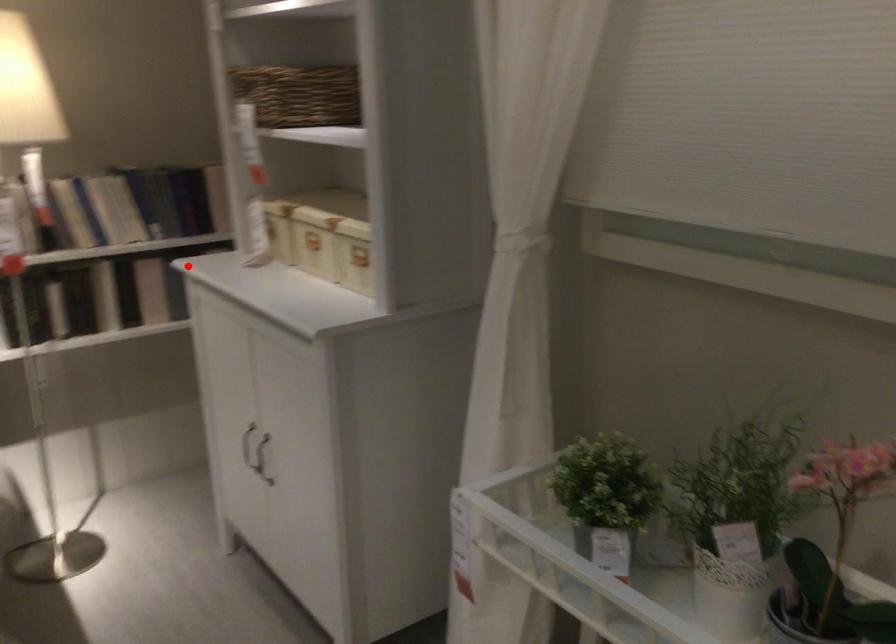
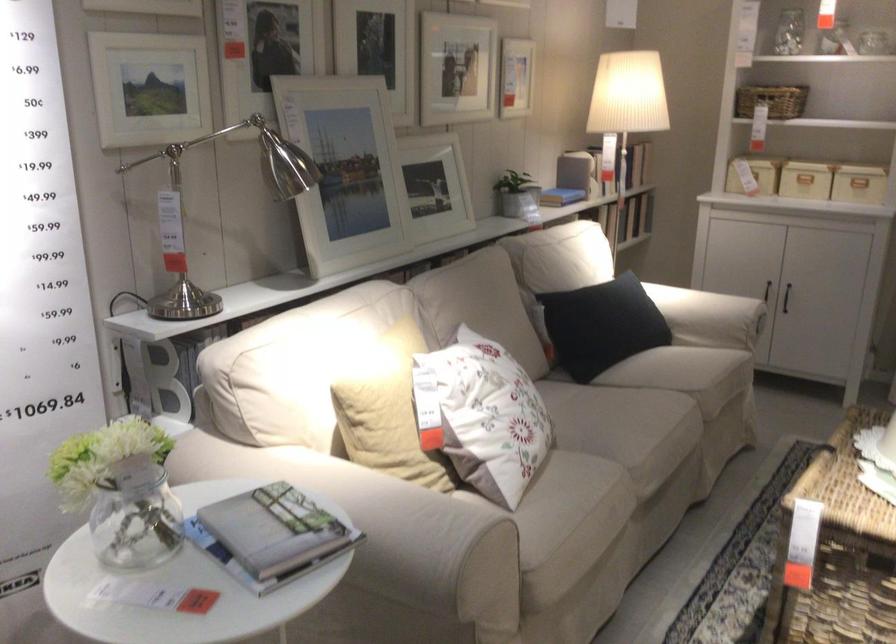
Question: I am providing you with two images of the same scene from different viewpoints. A red point is marked on the first image. Is the red point's position out of view in image 2?

Choices:
 (A) Yes
 (B) No

Answer: (B)